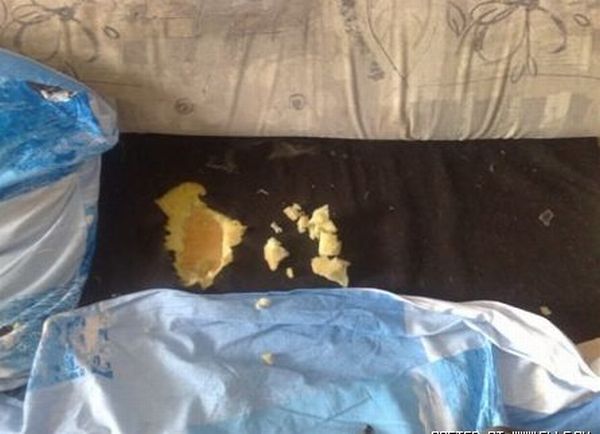
In order to click on dark brown fabric in this screenshot , I will do `click(442, 201)`.